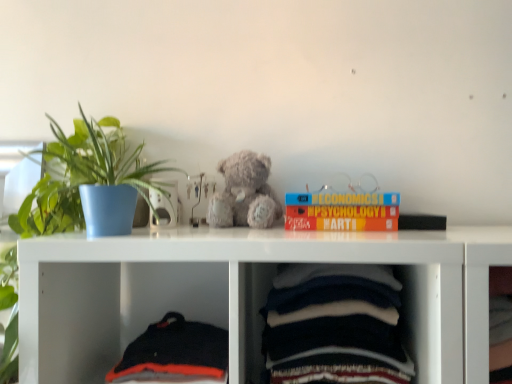
Question: Does black cotton sweater at lower left, the 2th baby clothe viewed from the right, have a smaller size compared to fuzzy gray teddy bear at center?

Choices:
 (A) no
 (B) yes

Answer: (A)

Question: Is black cotton sweater at lower left, the first baby clothe positioned from the left, looking in the opposite direction of fuzzy gray teddy bear at center?

Choices:
 (A) no
 (B) yes

Answer: (A)

Question: Is black cotton sweater at lower left, the 2th baby clothe viewed from the right, not close to fuzzy gray teddy bear at center?

Choices:
 (A) yes
 (B) no

Answer: (B)

Question: Could fuzzy gray teddy bear at center be considered to be inside black cotton sweater at lower left, the first baby clothe positioned from the left?

Choices:
 (A) no
 (B) yes

Answer: (A)

Question: From the image's perspective, does black cotton sweater at lower left, the 2th baby clothe viewed from the right, appear lower than fuzzy gray teddy bear at center?

Choices:
 (A) yes
 (B) no

Answer: (A)

Question: From the image's perspective, is dark blue cotton baby clothes at lower center, the first baby clothe positioned from the right, located above or below fuzzy gray teddy bear at center?

Choices:
 (A) above
 (B) below

Answer: (B)

Question: Considering the relative positions of dark blue cotton baby clothes at lower center, the first baby clothe positioned from the right, and fuzzy gray teddy bear at center in the image provided, is dark blue cotton baby clothes at lower center, the first baby clothe positioned from the right, to the left or to the right of fuzzy gray teddy bear at center?

Choices:
 (A) right
 (B) left

Answer: (A)

Question: Is dark blue cotton baby clothes at lower center, the 2th baby clothe positioned from the left, taller or shorter than fuzzy gray teddy bear at center?

Choices:
 (A) short
 (B) tall

Answer: (B)

Question: Considering the positions of point (374, 355) and point (247, 162), is point (374, 355) closer or farther from the camera than point (247, 162)?

Choices:
 (A) farther
 (B) closer

Answer: (B)

Question: Is dark blue cotton baby clothes at lower center, the first baby clothe positioned from the right, wider or thinner than black matte book at upper right, marked as the first book in a right-to-left arrangement?

Choices:
 (A) thin
 (B) wide

Answer: (B)

Question: Do you think dark blue cotton baby clothes at lower center, the first baby clothe positioned from the right, is within black matte book at upper right, marked as the first book in a right-to-left arrangement, or outside of it?

Choices:
 (A) outside
 (B) inside

Answer: (A)

Question: From the image's perspective, is dark blue cotton baby clothes at lower center, the first baby clothe positioned from the right, above or below black matte book at upper right, marked as the first book in a right-to-left arrangement?

Choices:
 (A) below
 (B) above

Answer: (A)

Question: In terms of size, does dark blue cotton baby clothes at lower center, the 2th baby clothe positioned from the left, appear bigger or smaller than black matte book at upper right, marked as the first book in a right-to-left arrangement?

Choices:
 (A) small
 (B) big

Answer: (B)

Question: From the image's perspective, is black cotton sweater at lower left, the first baby clothe positioned from the left, positioned above or below dark blue cotton baby clothes at lower center, the 2th baby clothe positioned from the left?

Choices:
 (A) above
 (B) below

Answer: (B)

Question: Does point (170, 357) appear closer or farther from the camera than point (338, 321)?

Choices:
 (A) farther
 (B) closer

Answer: (A)